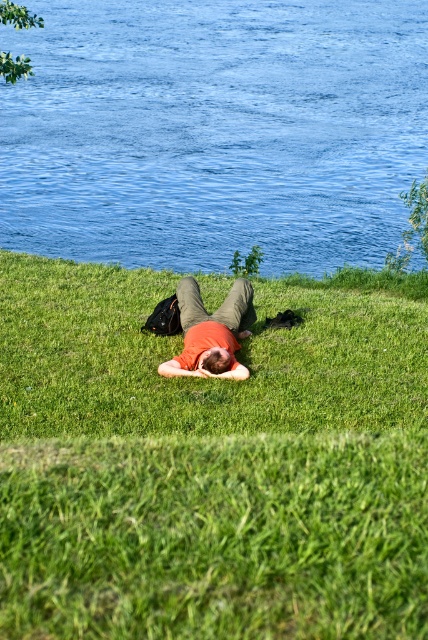
Between green grassy at center and blue liquid water at upper center, which one appears on the left side from the viewer's perspective?

From the viewer's perspective, blue liquid water at upper center appears more on the left side.

Is green grassy at center wider than blue liquid water at upper center?

Incorrect, green grassy at center's width does not surpass blue liquid water at upper center's.

This screenshot has width=428, height=640. I want to click on green grassy at center, so click(x=208, y=467).

Locate an element on the screen. This screenshot has width=428, height=640. green grassy at center is located at coordinates (208, 467).

Can you confirm if blue liquid water at upper center is wider than orange cotton shirt at center?

Indeed, blue liquid water at upper center has a greater width compared to orange cotton shirt at center.

What do you see at coordinates (214, 131) in the screenshot?
I see `blue liquid water at upper center` at bounding box center [214, 131].

Between point (202, 93) and point (158, 372), which one is positioned behind?

Point (202, 93)

Identify the location of blue liquid water at upper center. This screenshot has height=640, width=428. (214, 131).

From the picture: Can you confirm if green grassy at center is smaller than orange cotton shirt at center?

Yes.

Can you confirm if green grassy at center is thinner than orange cotton shirt at center?

Yes.

I want to click on green grassy at center, so click(208, 467).

Where is `green grassy at center`? This screenshot has width=428, height=640. green grassy at center is located at coordinates (208, 467).